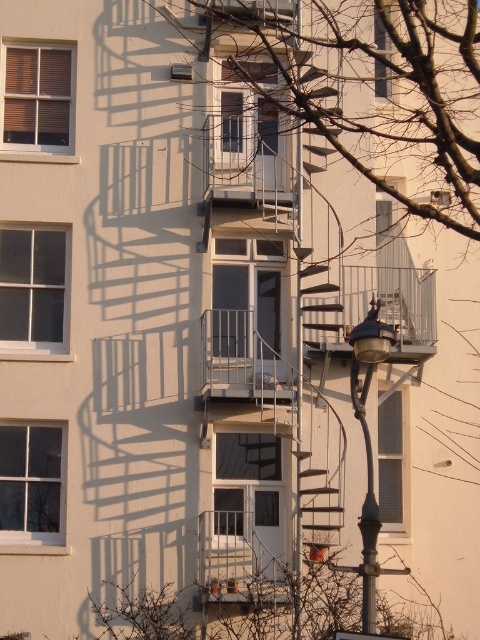
Is clear glass window at lower left bigger than clear glass window at center?

No, clear glass window at lower left is not bigger than clear glass window at center.

Is point (22, 497) farther from camera compared to point (391, 392)?

No, it is in front of (391, 392).

Between point (10, 476) and point (383, 460), which one is positioned in front?

Point (10, 476) is in front.

Locate an element on the screen. Image resolution: width=480 pixels, height=640 pixels. clear glass window at lower left is located at coordinates (31, 480).

Does metallic silver balcony at center appear under transparent glass door at center?

Incorrect, metallic silver balcony at center is not positioned below transparent glass door at center.

Is point (269, 353) in front of point (259, 513)?

No, it is not.

Locate an element on the screen. The width and height of the screenshot is (480, 640). metallic silver balcony at center is located at coordinates (241, 360).

I want to click on clear glass window at upper left, so click(33, 285).

I want to click on clear glass window at upper left, so click(33, 285).